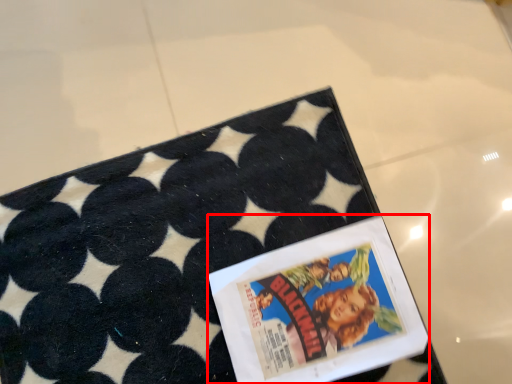
Question: From the image, what is the correct spatial relationship of comic book (annotated by the red box) in relation to tray?

Choices:
 (A) left
 (B) right

Answer: (B)